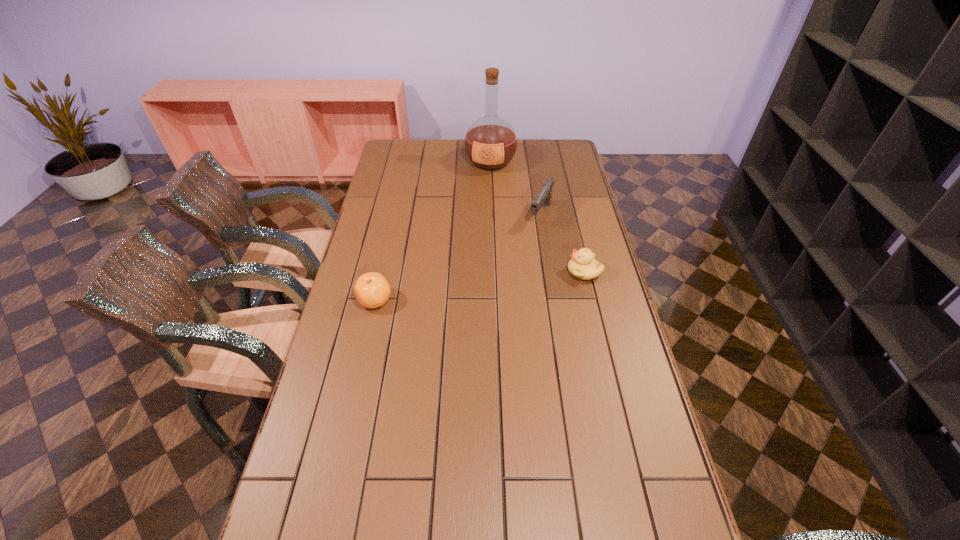
You are a GUI agent. You are given a task and a screenshot of the screen. Output one action in this format:
    pyautogui.click(x=<x>, y=<y>)
    Task: Click on the vacant space on the desktop that is between the nearest object and the third farthest object and is positioned in the direction the third object from left to right is aimed
    This screenshot has width=960, height=540.
    Given the screenshot: What is the action you would take?
    pyautogui.click(x=498, y=283)

Identify the location of vacant spot on the desktop that is between the nearest object and the rightmost object and is positioned on the front label of the liquor. The image size is (960, 540). (460, 288).